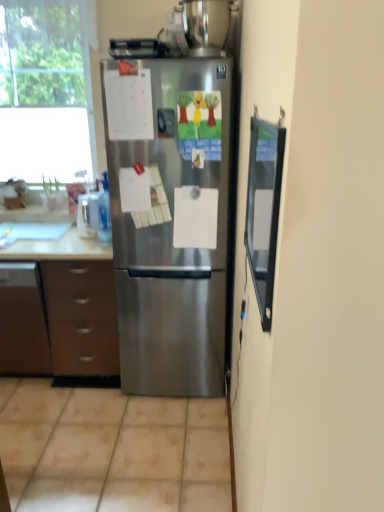
Question: Is transparent glass screen door at right to the right of transparent glass window at upper left from the viewer's perspective?

Choices:
 (A) no
 (B) yes

Answer: (B)

Question: From the image's perspective, is transparent glass screen door at right beneath transparent glass window at upper left?

Choices:
 (A) no
 (B) yes

Answer: (B)

Question: Can transparent glass window at upper left be found inside transparent glass screen door at right?

Choices:
 (A) no
 (B) yes

Answer: (A)

Question: From a real-world perspective, is transparent glass screen door at right physically below transparent glass window at upper left?

Choices:
 (A) yes
 (B) no

Answer: (A)

Question: Is there a large distance between transparent glass screen door at right and transparent glass window at upper left?

Choices:
 (A) no
 (B) yes

Answer: (B)

Question: Can you confirm if transparent glass screen door at right is thinner than transparent glass window at upper left?

Choices:
 (A) no
 (B) yes

Answer: (B)

Question: From the image's perspective, is stainless steel pot at upper center, which is the 1th appliance in right-to-left order, located above stainless steel refrigerator at center?

Choices:
 (A) yes
 (B) no

Answer: (A)

Question: Is stainless steel pot at upper center, which is the 1th appliance in right-to-left order, smaller than stainless steel refrigerator at center?

Choices:
 (A) yes
 (B) no

Answer: (A)

Question: Is stainless steel pot at upper center, marked as the second appliance in a left-to-right arrangement, bigger than stainless steel refrigerator at center?

Choices:
 (A) yes
 (B) no

Answer: (B)

Question: Does stainless steel pot at upper center, marked as the second appliance in a left-to-right arrangement, have a greater height compared to stainless steel refrigerator at center?

Choices:
 (A) no
 (B) yes

Answer: (A)

Question: Does stainless steel pot at upper center, marked as the second appliance in a left-to-right arrangement, have a lesser width compared to stainless steel refrigerator at center?

Choices:
 (A) no
 (B) yes

Answer: (B)

Question: From the image's perspective, does stainless steel pot at upper center, marked as the second appliance in a left-to-right arrangement, appear lower than stainless steel refrigerator at center?

Choices:
 (A) no
 (B) yes

Answer: (A)

Question: Is the surface of stainless steel refrigerator at center in direct contact with white glossy sink at left?

Choices:
 (A) no
 (B) yes

Answer: (A)